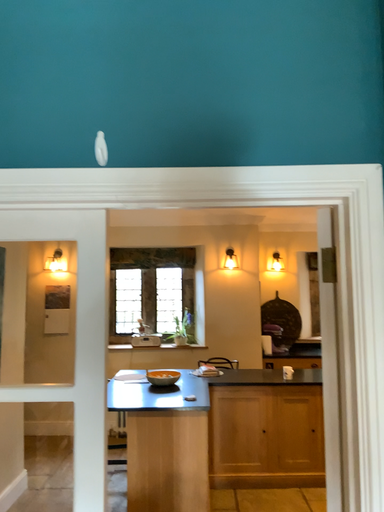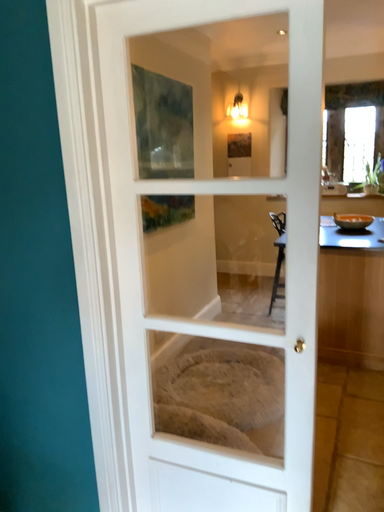
Question: How did the camera likely rotate when shooting the video?

Choices:
 (A) rotated right
 (B) rotated left

Answer: (B)